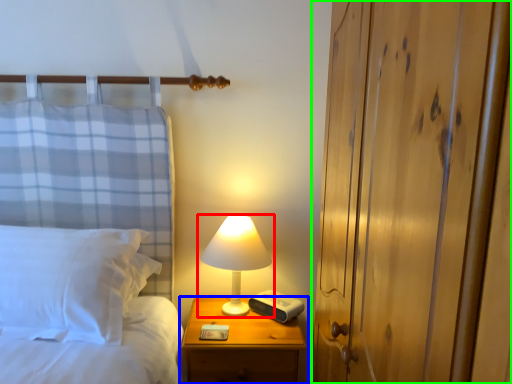
Question: Which object is positioned farthest from lamp (highlighted by a red box)? Select from nightstand (highlighted by a blue box) and dresser (highlighted by a green box).

Choices:
 (A) nightstand
 (B) dresser

Answer: (B)